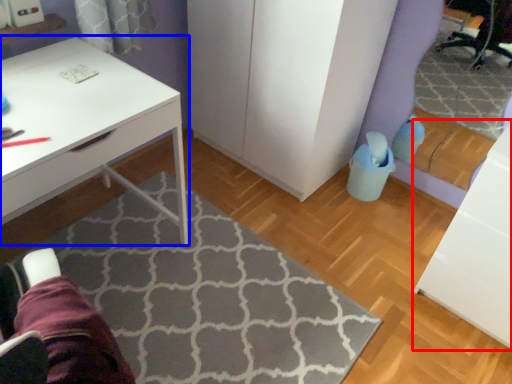
Question: Which of the following is the closest to the observer, file cabinet (highlighted by a red box) or desk (highlighted by a blue box)?

Choices:
 (A) file cabinet
 (B) desk

Answer: (B)